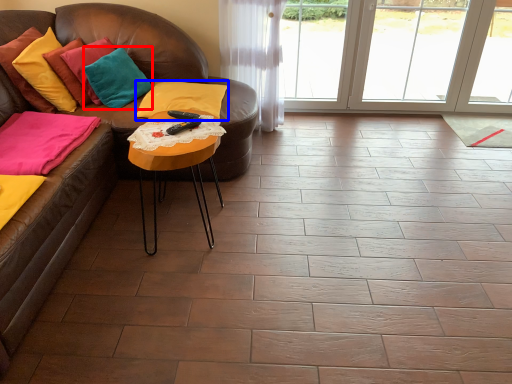
Question: Which point is closer to the camera, pillow (highlighted by a red box) or pillow (highlighted by a blue box)?

Choices:
 (A) pillow
 (B) pillow

Answer: (A)